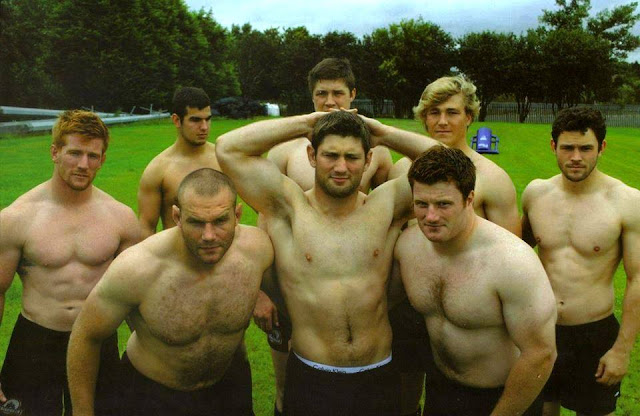
The width and height of the screenshot is (640, 416). Find the location of `chest`. chest is located at coordinates point(592,224), point(473,290), point(361,242), point(232,296), point(84,236), point(177,178), point(305,170).